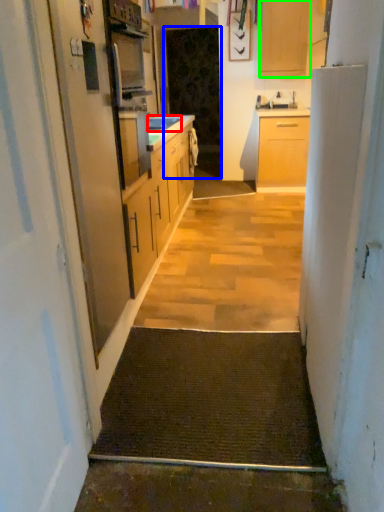
Question: Estimate the real-world distances between objects in this image. Which object is farther from sink (highlighted by a red box), screen door (highlighted by a blue box) or cabinetry (highlighted by a green box)?

Choices:
 (A) screen door
 (B) cabinetry

Answer: (B)